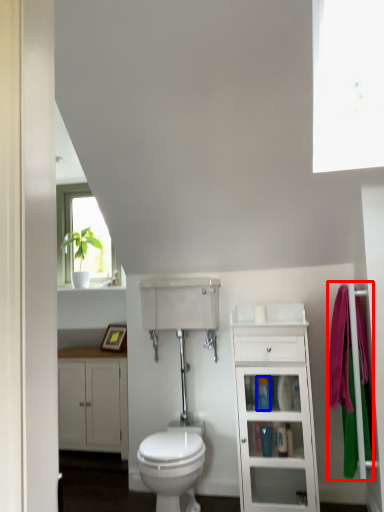
Question: Which object is closer to the camera taking this photo, bath towel (highlighted by a red box) or toiletry (highlighted by a blue box)?

Choices:
 (A) bath towel
 (B) toiletry

Answer: (A)